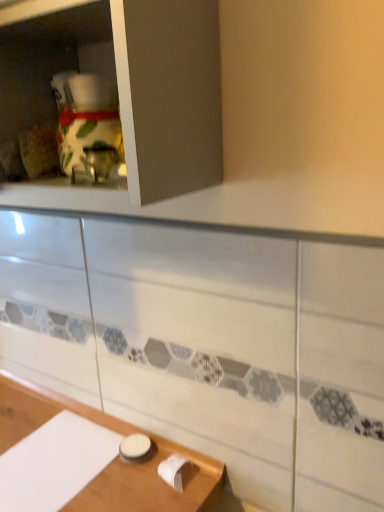
This screenshot has width=384, height=512. Describe the element at coordinates (135, 448) in the screenshot. I see `white glossy jar at lower center` at that location.

Where is `white glossy jar at lower center`? Image resolution: width=384 pixels, height=512 pixels. white glossy jar at lower center is located at coordinates tap(135, 448).

The height and width of the screenshot is (512, 384). Find the location of `white glossy cabinet at upper left`. white glossy cabinet at upper left is located at coordinates (169, 95).

Measure the distance between point [183,142] and camera.

Point [183,142] is 22.13 inches away from camera.

Describe the element at coordinates (169, 95) in the screenshot. I see `white glossy cabinet at upper left` at that location.

The image size is (384, 512). In order to click on white glossy jar at lower center in this screenshot , I will do `click(135, 448)`.

Considering the relative positions of white glossy jar at lower center and white glossy cabinet at upper left in the image provided, is white glossy jar at lower center to the right of white glossy cabinet at upper left from the viewer's perspective?

Yes, white glossy jar at lower center is to the right of white glossy cabinet at upper left.

Is the position of white glossy jar at lower center less distant than that of white glossy cabinet at upper left?

No, white glossy jar at lower center is further to the viewer.

Is point (145, 442) closer to camera compared to point (130, 202)?

No, it is not.

From the image's perspective, is white glossy jar at lower center beneath white glossy cabinet at upper left?

Correct, white glossy jar at lower center appears lower than white glossy cabinet at upper left in the image.

From a real-world perspective, which is physically below, white glossy jar at lower center or white glossy cabinet at upper left?

From a 3D spatial view, white glossy jar at lower center is below.

Which object is wider, white glossy jar at lower center or white glossy cabinet at upper left?

With larger width is white glossy cabinet at upper left.

Is white glossy jar at lower center taller than white glossy cabinet at upper left?

In fact, white glossy jar at lower center may be shorter than white glossy cabinet at upper left.

Between white glossy jar at lower center and white glossy cabinet at upper left, which one has smaller size?

white glossy jar at lower center is smaller.

Could white glossy cabinet at upper left be considered to be inside white glossy jar at lower center?

No, white glossy cabinet at upper left is located outside of white glossy jar at lower center.

Is white glossy jar at lower center beside white glossy cabinet at upper left?

No, white glossy jar at lower center is not beside white glossy cabinet at upper left.

Could you tell me if white glossy jar at lower center is turned towards white glossy cabinet at upper left?

No, white glossy jar at lower center is not facing towards white glossy cabinet at upper left.

In the image, there is a white glossy jar at lower center. In order to click on cabinetry above it (from the image's perspective) in this screenshot , I will do `click(169, 95)`.

Does white glossy cabinet at upper left appear on the right side of white glossy jar at lower center?

No.

Is white glossy cabinet at upper left positioned behind white glossy jar at lower center?

No, it is in front of white glossy jar at lower center.

Is point (129, 59) positioned before point (120, 451)?

Yes.

From the image's perspective, is white glossy cabinet at upper left above or below white glossy jar at lower center?

white glossy cabinet at upper left is above white glossy jar at lower center.

From a real-world perspective, who is located higher, white glossy cabinet at upper left or white glossy jar at lower center?

white glossy cabinet at upper left, from a real-world perspective.

Which of these two, white glossy cabinet at upper left or white glossy jar at lower center, is thinner?

white glossy jar at lower center.

Considering the sizes of white glossy cabinet at upper left and white glossy jar at lower center in the image, is white glossy cabinet at upper left taller or shorter than white glossy jar at lower center?

white glossy cabinet at upper left is taller than white glossy jar at lower center.

Who is bigger, white glossy cabinet at upper left or white glossy jar at lower center?

white glossy cabinet at upper left.

Can white glossy jar at lower center be found inside white glossy cabinet at upper left?

No, white glossy cabinet at upper left does not contain white glossy jar at lower center.

Is white glossy cabinet at upper left far from white glossy jar at lower center?

They are positioned close to each other.

Is white glossy cabinet at upper left oriented towards white glossy jar at lower center?

No, white glossy cabinet at upper left does not turn towards white glossy jar at lower center.

How different are the orientations of white glossy cabinet at upper left and white glossy jar at lower center in degrees?

The angle between the facing direction of white glossy cabinet at upper left and the facing direction of white glossy jar at lower center is 2.09 degrees.

Find the location of a particular element. This screenshot has height=512, width=384. tableware below the white glossy cabinet at upper left (from the image's perspective) is located at coordinates (135, 448).

This screenshot has height=512, width=384. I want to click on tableware below the white glossy cabinet at upper left (from a real-world perspective), so click(135, 448).

Identify the location of cabinetry that appears above the white glossy jar at lower center (from a real-world perspective). (169, 95).